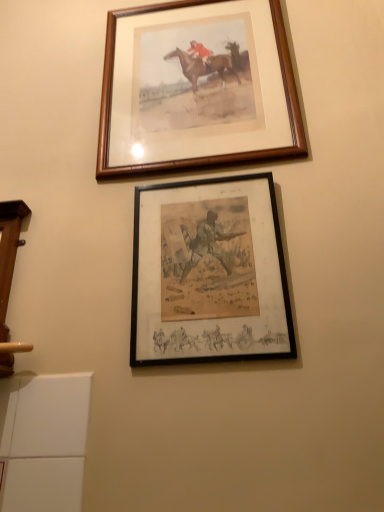
Question: Visually, is wooden frame at upper center, acting as the 1th picture frame starting from the top, positioned to the left or to the right of black matte picture frame at center, the 1th picture frame positioned from the front?

Choices:
 (A) left
 (B) right

Answer: (A)

Question: In terms of size, does wooden frame at upper center, placed as the 2th picture frame when sorted from bottom to top, appear bigger or smaller than black matte picture frame at center, which ranks as the 1th picture frame in bottom-to-top order?

Choices:
 (A) big
 (B) small

Answer: (A)

Question: Considering their positions, is wooden frame at upper center, the first picture frame viewed from the back, located in front of or behind black matte picture frame at center, which ranks as the 1th picture frame in bottom-to-top order?

Choices:
 (A) behind
 (B) front

Answer: (A)

Question: In terms of width, does black matte picture frame at center, which is the 2th picture frame in top-to-bottom order, look wider or thinner when compared to wooden frame at upper center, the first picture frame viewed from the back?

Choices:
 (A) thin
 (B) wide

Answer: (A)

Question: Do you think black matte picture frame at center, the 1th picture frame positioned from the front, is within wooden frame at upper center, acting as the 1th picture frame starting from the top, or outside of it?

Choices:
 (A) outside
 (B) inside

Answer: (A)

Question: From a real-world perspective, is black matte picture frame at center, which ranks as the 1th picture frame in bottom-to-top order, physically located above or below wooden frame at upper center, positioned as the 2th picture frame in front-to-back order?

Choices:
 (A) above
 (B) below

Answer: (B)

Question: In terms of size, does black matte picture frame at center, acting as the second picture frame starting from the back, appear bigger or smaller than wooden frame at upper center, the first picture frame viewed from the back?

Choices:
 (A) big
 (B) small

Answer: (B)